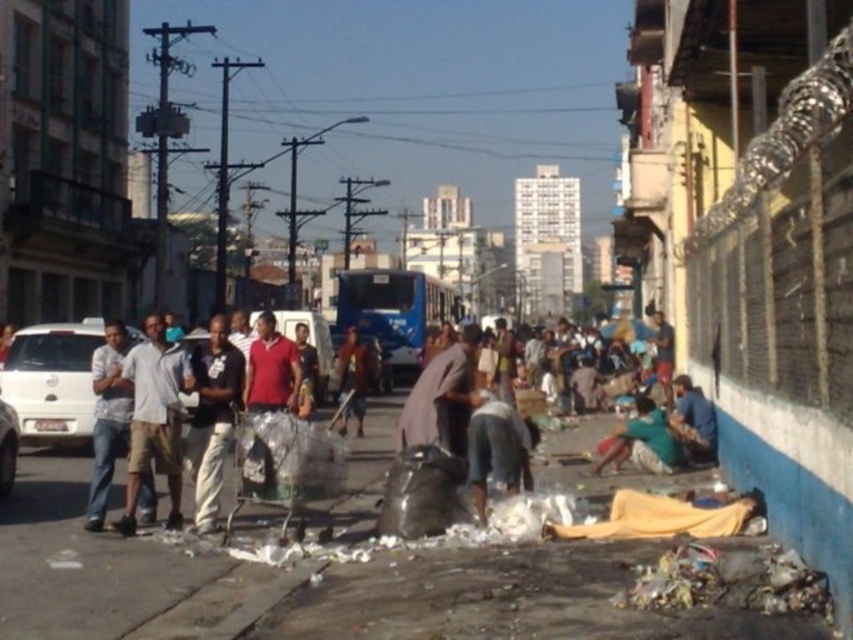
You are a photographer standing at the camera position. You want to take a photo that includes both the point at coordinates point [115,435] and point [460,362]. Which point should you focus on first to ensure both are in focus?

You should focus on point [115,435] first because it is closer to the camera than point [460,362]. This ensures the closer point is in focus, and the farther point will also be sharp due to depth of field.

You are a photographer standing in the urban street scene and want to capture both the yellow fabric at lower right and the green fabric shirt at lower right in the same frame. Which fabric should you focus on first to ensure both are in the frame?

The yellow fabric at lower right is shorter than the green fabric shirt at lower right, so you should focus on the green fabric shirt at lower right first to ensure both are in the frame.